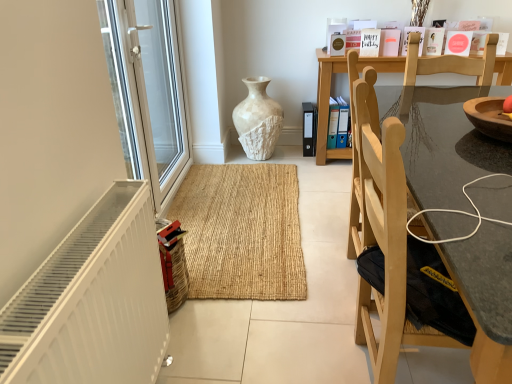
Question: Is the surface of white glossy screen door at left in direct contact with white matte radiator at lower left?

Choices:
 (A) yes
 (B) no

Answer: (B)

Question: Is white glossy screen door at left taller than white matte radiator at lower left?

Choices:
 (A) no
 (B) yes

Answer: (B)

Question: From the image's perspective, does white glossy screen door at left appear lower than white matte radiator at lower left?

Choices:
 (A) yes
 (B) no

Answer: (B)

Question: Considering the relative positions of white glossy screen door at left and white matte radiator at lower left in the image provided, is white glossy screen door at left behind white matte radiator at lower left?

Choices:
 (A) no
 (B) yes

Answer: (B)

Question: Considering the relative positions of white glossy screen door at left and white matte radiator at lower left in the image provided, is white glossy screen door at left to the left of white matte radiator at lower left from the viewer's perspective?

Choices:
 (A) yes
 (B) no

Answer: (A)

Question: Considering the positions of white glossy screen door at left and white textured vase at center in the image, is white glossy screen door at left wider or thinner than white textured vase at center?

Choices:
 (A) thin
 (B) wide

Answer: (A)

Question: From the image's perspective, relative to white textured vase at center, is white glossy screen door at left above or below?

Choices:
 (A) above
 (B) below

Answer: (A)

Question: Is point (162, 33) positioned closer to the camera than point (266, 102)?

Choices:
 (A) closer
 (B) farther

Answer: (A)

Question: Do you think white glossy screen door at left is within white textured vase at center, or outside of it?

Choices:
 (A) inside
 (B) outside

Answer: (B)

Question: In terms of width, does white textured vase at center look wider or thinner when compared to white matte radiator at lower left?

Choices:
 (A) wide
 (B) thin

Answer: (A)

Question: Considering the positions of point (241, 114) and point (55, 367), is point (241, 114) closer or farther from the camera than point (55, 367)?

Choices:
 (A) farther
 (B) closer

Answer: (A)

Question: Which is correct: white textured vase at center is inside white matte radiator at lower left, or outside of it?

Choices:
 (A) inside
 (B) outside

Answer: (B)

Question: Based on their sizes in the image, would you say white textured vase at center is bigger or smaller than white matte radiator at lower left?

Choices:
 (A) small
 (B) big

Answer: (B)

Question: Is light wood chair at right situated inside white textured vase at center or outside?

Choices:
 (A) inside
 (B) outside

Answer: (B)

Question: Is light wood chair at right bigger or smaller than white textured vase at center?

Choices:
 (A) small
 (B) big

Answer: (B)